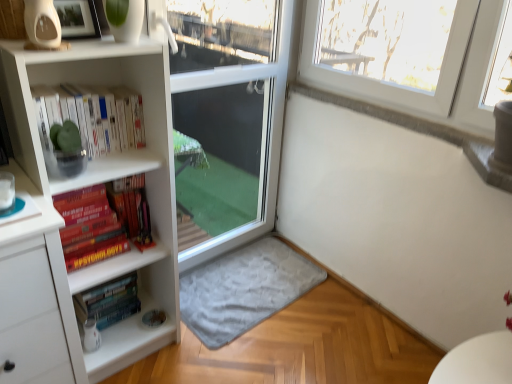
Where is `gray soft rug at lower center`? The image size is (512, 384). gray soft rug at lower center is located at coordinates (244, 289).

In order to face transparent glass screen door at center, should I rotate leftwards or rightwards?

Rotate left and turn 3.760 degrees.

The height and width of the screenshot is (384, 512). Identify the location of hardcover books at lower left, which appears as the 2th book when viewed from the top. (109, 301).

Measure the distance between transparent glass screen door at center and gray soft rug at lower center.

A distance of 22.42 inches exists between transparent glass screen door at center and gray soft rug at lower center.

Could you tell me if transparent glass screen door at center is facing gray soft rug at lower center?

Yes.

Consider the image. Is the position of transparent glass screen door at center less distant than that of gray soft rug at lower center?

Yes, transparent glass screen door at center is in front of gray soft rug at lower center.

Considering the sizes of objects transparent glass screen door at center and gray soft rug at lower center in the image provided, who is thinner, transparent glass screen door at center or gray soft rug at lower center?

Thinner between the two is transparent glass screen door at center.

Considering the points (72, 261) and (29, 103), which point is behind, point (72, 261) or point (29, 103)?

The point (72, 261) is behind.

Is hardcover psychology book at left, which is the 1th book in top-to-bottom order, in front of or behind white glossy bookshelf at upper left in the image?

hardcover psychology book at left, which is the 1th book in top-to-bottom order, is positioned farther from the viewer than white glossy bookshelf at upper left.

Could you measure the distance between hardcover psychology book at left, which is the 2th book from bottom to top, and white glossy bookshelf at upper left?

hardcover psychology book at left, which is the 2th book from bottom to top, and white glossy bookshelf at upper left are 9.97 inches apart from each other.

From a real-world perspective, which is physically below, hardcover psychology book at left, which is the 1th book in top-to-bottom order, or white glossy bookshelf at upper left?

From a 3D spatial view, hardcover psychology book at left, which is the 1th book in top-to-bottom order, is below.

Measure the distance between gray soft rug at lower center and hardcover psychology book at left, which is the 1th book in top-to-bottom order.

gray soft rug at lower center and hardcover psychology book at left, which is the 1th book in top-to-bottom order, are 66.26 centimeters apart from each other.

Is gray soft rug at lower center not close to hardcover psychology book at left, which is the 2th book from bottom to top?

No, gray soft rug at lower center is not far from hardcover psychology book at left, which is the 2th book from bottom to top.

Consider the image. Is gray soft rug at lower center taller than hardcover psychology book at left, which is the 1th book in top-to-bottom order?

In fact, gray soft rug at lower center may be shorter than hardcover psychology book at left, which is the 1th book in top-to-bottom order.

From the gray soft rug at lower center, count 2nd books forward and point to it. Please provide its 2D coordinates.

[(104, 224)]

From the image's perspective, is gray soft rug at lower center above or below transparent glass screen door at center?

Clearly, from the image's perspective, gray soft rug at lower center is below transparent glass screen door at center.

Is gray soft rug at lower center thinner than transparent glass screen door at center?

No.

In the scene shown: Between gray soft rug at lower center and transparent glass screen door at center, which one is positioned in front?

Positioned in front is transparent glass screen door at center.

Identify the location of screen door in front of the gray soft rug at lower center. (229, 117).

From a real-world perspective, which object rests below the other?

gray soft rug at lower center, from a real-world perspective.

From the image's perspective, is hardcover psychology book at left, which is the 2th book from bottom to top, located above gray soft rug at lower center?

Yes.

Are hardcover psychology book at left, which is the 2th book from bottom to top, and gray soft rug at lower center located far from each other?

hardcover psychology book at left, which is the 2th book from bottom to top, is actually quite close to gray soft rug at lower center.

Looking at their sizes, would you say hardcover psychology book at left, which is the 2th book from bottom to top, is wider or thinner than gray soft rug at lower center?

hardcover psychology book at left, which is the 2th book from bottom to top, is thinner than gray soft rug at lower center.

You are a GUI agent. You are given a task and a screenshot of the screen. Output one action in this format:
    pyautogui.click(x=<x>, y=<y>)
    Task: Click on the screen door located below the white glossy bookshelf at upper left (from the image's perspective)
    
    Given the screenshot: What is the action you would take?
    pyautogui.click(x=229, y=117)

From the picture: Is white glossy bookshelf at upper left looking in the opposite direction of transparent glass screen door at center?

No.

Considering the relative sizes of white glossy bookshelf at upper left and transparent glass screen door at center in the image provided, is white glossy bookshelf at upper left wider than transparent glass screen door at center?

Yes, white glossy bookshelf at upper left is wider than transparent glass screen door at center.

Is the depth of hardcover books at lower left, the 1th book when ordered from bottom to top, greater than that of white glossy bookshelf at upper left?

Yes, hardcover books at lower left, the 1th book when ordered from bottom to top, is behind white glossy bookshelf at upper left.

Where is `cabinet in front of the hardcover books at lower left, which appears as the 2th book when viewed from the top`? Image resolution: width=512 pixels, height=384 pixels. cabinet in front of the hardcover books at lower left, which appears as the 2th book when viewed from the top is located at coordinates (115, 153).

Is point (128, 303) farther from camera compared to point (42, 179)?

Yes, point (128, 303) is behind point (42, 179).

The height and width of the screenshot is (384, 512). In order to click on wide below the transparent glass screen door at center (from a real-world perspective) in this screenshot , I will do `click(244, 289)`.

Locate an element on the screen. This screenshot has width=512, height=384. cabinet located above the hardcover psychology book at left, which is the 1th book in top-to-bottom order (from the image's perspective) is located at coordinates (115, 153).

When comparing their distances from hardcover books at lower left, the 1th book when ordered from bottom to top, does gray soft rug at lower center or transparent glass screen door at center seem closer?

gray soft rug at lower center is positioned closer to the anchor hardcover books at lower left, the 1th book when ordered from bottom to top.

Consider the image. From the image, which object appears to be nearer to white glossy bookshelf at upper left, transparent glass screen door at center or gray soft rug at lower center?

transparent glass screen door at center.

Considering their positions, is hardcover psychology book at left, which is the 2th book from bottom to top, positioned further to gray soft rug at lower center than white glossy bookshelf at upper left?

Among the two, white glossy bookshelf at upper left is located further to gray soft rug at lower center.

In the scene shown: When comparing their distances from hardcover psychology book at left, which is the 2th book from bottom to top, does transparent glass screen door at center or white glossy bookshelf at upper left seem further?

transparent glass screen door at center lies further to hardcover psychology book at left, which is the 2th book from bottom to top, than the other object.

Considering their positions, is gray soft rug at lower center positioned closer to transparent glass screen door at center than hardcover books at lower left, which appears as the 2th book when viewed from the top?

Based on the image, gray soft rug at lower center appears to be nearer to transparent glass screen door at center.

From the image, which object appears to be farther from transparent glass screen door at center, white glossy bookshelf at upper left or hardcover books at lower left, the 1th book when ordered from bottom to top?

Based on the image, hardcover books at lower left, the 1th book when ordered from bottom to top, appears to be further to transparent glass screen door at center.

Considering their positions, is hardcover books at lower left, which appears as the 2th book when viewed from the top, positioned closer to hardcover psychology book at left, which is the 2th book from bottom to top, than transparent glass screen door at center?

hardcover books at lower left, which appears as the 2th book when viewed from the top, lies closer to hardcover psychology book at left, which is the 2th book from bottom to top, than the other object.

Which object lies further to the anchor point transparent glass screen door at center, gray soft rug at lower center or white glossy bookshelf at upper left?

Among the two, white glossy bookshelf at upper left is located further to transparent glass screen door at center.

In order to click on screen door between white glossy bookshelf at upper left and hardcover books at lower left, the 1th book when ordered from bottom to top, vertically in this screenshot , I will do `click(229, 117)`.

At what (x,y) coordinates should I click in order to perform the action: click on book between transparent glass screen door at center and hardcover books at lower left, which appears as the 2th book when viewed from the top, vertically. Please return your answer as a coordinate pair (x, y). This screenshot has height=384, width=512. Looking at the image, I should click on (104, 224).

At what (x,y) coordinates should I click in order to perform the action: click on book between hardcover psychology book at left, which is the 2th book from bottom to top, and gray soft rug at lower center. Please return your answer as a coordinate pair (x, y). The width and height of the screenshot is (512, 384). Looking at the image, I should click on (109, 301).

The width and height of the screenshot is (512, 384). Identify the location of screen door between white glossy bookshelf at upper left and gray soft rug at lower center in the vertical direction. (229, 117).